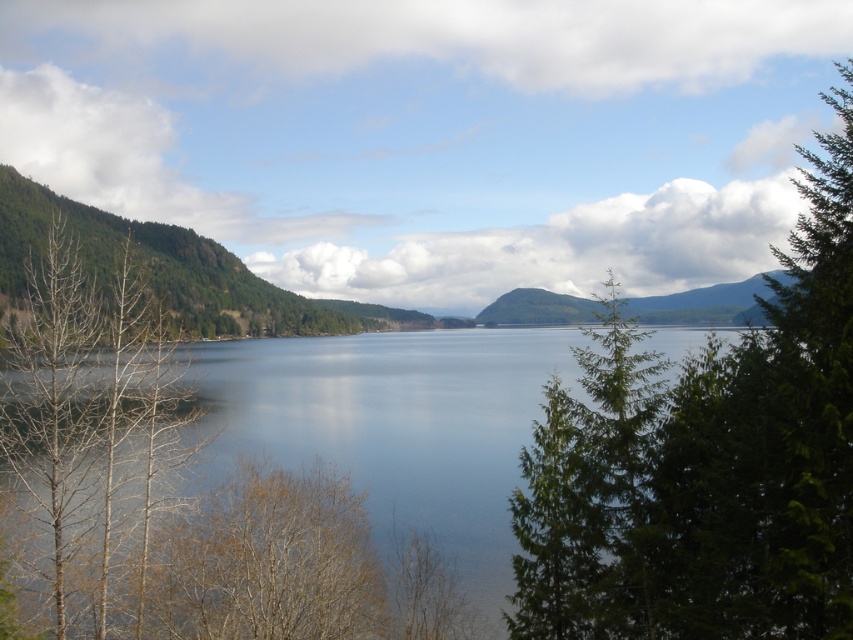
You are standing in the natural landscape scene and want to walk towards the green forested mountain at center. However, there is a brown leafless tree at left blocking your path. Can you walk around it to reach the mountain?

The brown leafless tree at left is further to the viewer than the green forested mountain at center, so you can walk around it to reach the mountain.

You are standing in the natural landscape scene. You see the transparent water at center and the brown leafless tree at left. Which object is closer to your right side?

The transparent water at center is closer to your right side because it is positioned to the right of the brown leafless tree at left.

You are standing at the origin point in the scene. What are the coordinates of the transparent water at center?

The coordinates of the transparent water at center are at point (395, 426).